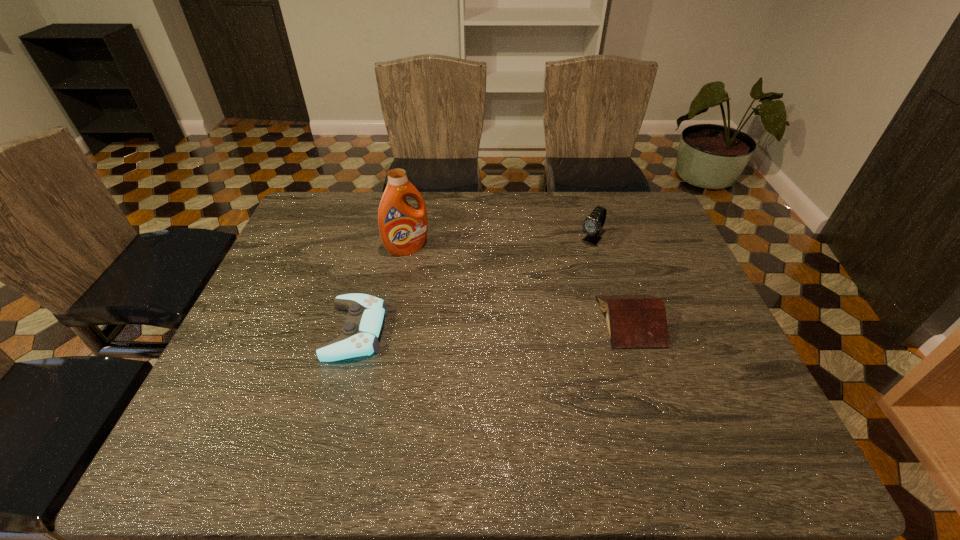
The height and width of the screenshot is (540, 960). Identify the location of control. (362, 329).

The height and width of the screenshot is (540, 960). Identify the location of book. (633, 321).

The height and width of the screenshot is (540, 960). Find the location of `the third shortest object`. the third shortest object is located at coordinates (592, 225).

Where is `the tallest object`? the tallest object is located at coordinates (403, 228).

Locate an element on the screen. The height and width of the screenshot is (540, 960). vacant space located on the left of the control is located at coordinates (252, 331).

Where is `free space located on the left of the book`? The image size is (960, 540). free space located on the left of the book is located at coordinates (504, 321).

What are the coordinates of `vacant region located 0.080m on the face of the watch` in the screenshot? It's located at (572, 261).

I want to click on vacant area situated on the face of the watch, so click(x=543, y=291).

In order to click on vacant area located on the face of the watch in this screenshot , I will do `click(543, 291)`.

I want to click on vacant region located 0.400m on the front-facing side of the tallest object, so click(487, 350).